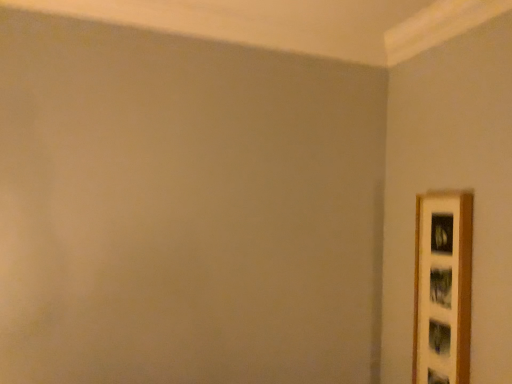
Describe the element at coordinates (442, 288) in the screenshot. Image resolution: width=512 pixels, height=384 pixels. I see `wooden picture frame at right` at that location.

What is the approximate height of wooden picture frame at right?

It is 26.48 inches.

You are a GUI agent. You are given a task and a screenshot of the screen. Output one action in this format:
    pyautogui.click(x=<x>, y=<y>)
    Task: Click on the wooden picture frame at right
    The image size is (512, 384).
    Given the screenshot: What is the action you would take?
    pyautogui.click(x=442, y=288)

Find the location of `wooden picture frame at right`. wooden picture frame at right is located at coordinates (442, 288).